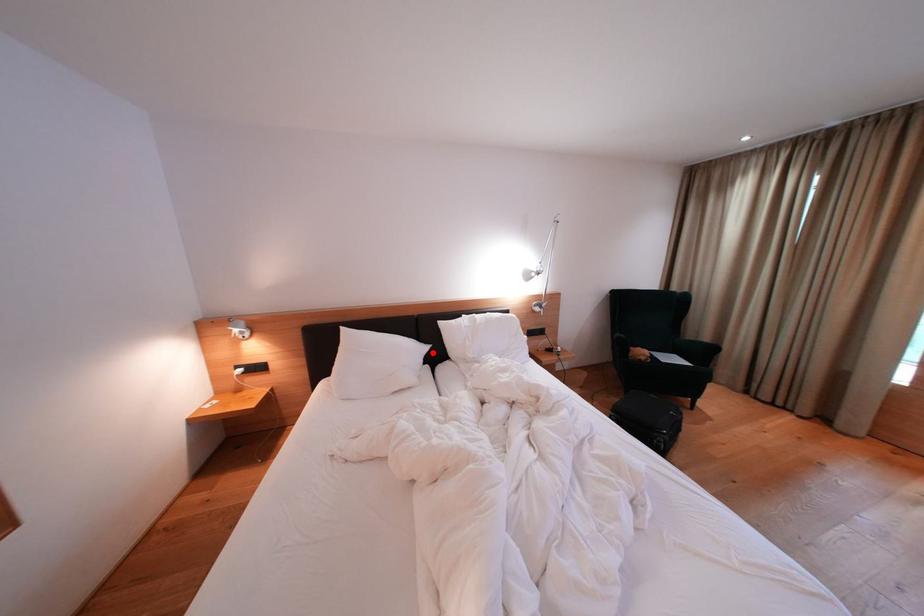
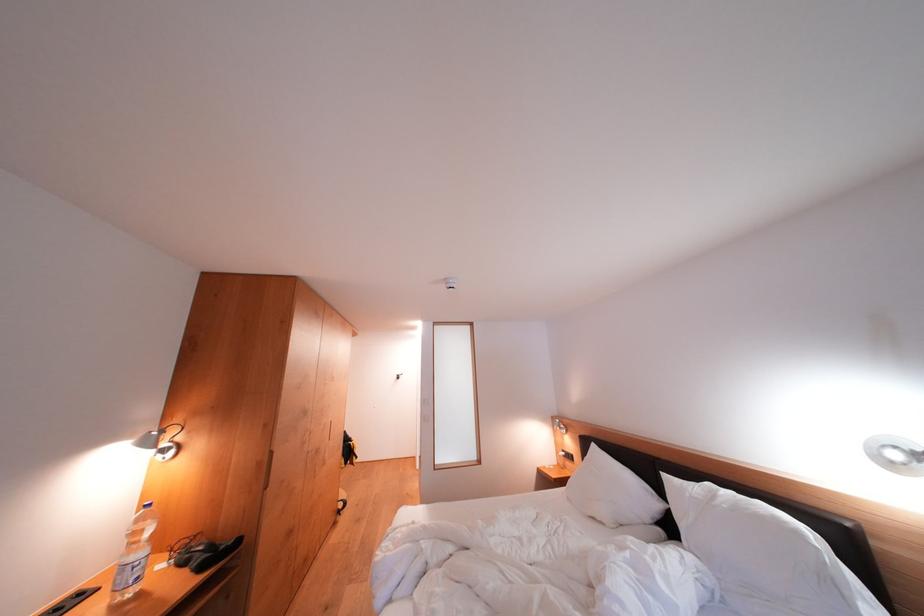
Question: I am providing you with two images of the same scene from different viewpoints. A red point is shown in image1. For the corresponding object point in image2, is it positioned nearer or farther from the camera?

Choices:
 (A) Nearer
 (B) Farther

Answer: (A)